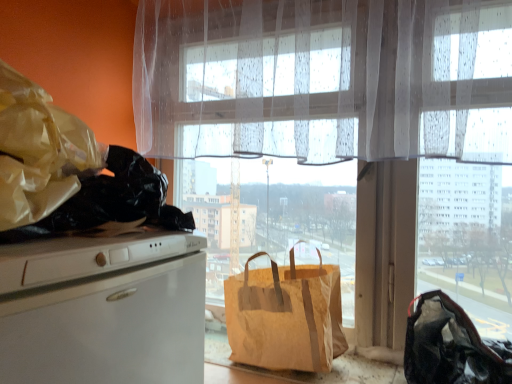
Question: Is translucent fabric window at center facing towards translucent white curtain at upper center?

Choices:
 (A) yes
 (B) no

Answer: (A)

Question: Does translucent fabric window at center appear on the left side of translucent white curtain at upper center?

Choices:
 (A) yes
 (B) no

Answer: (B)

Question: Does translucent fabric window at center come in front of translucent white curtain at upper center?

Choices:
 (A) yes
 (B) no

Answer: (B)

Question: From a real-world perspective, is translucent fabric window at center located beneath translucent white curtain at upper center?

Choices:
 (A) no
 (B) yes

Answer: (B)

Question: Does translucent fabric window at center have a greater height compared to translucent white curtain at upper center?

Choices:
 (A) yes
 (B) no

Answer: (A)

Question: Considering the relative sizes of translucent fabric window at center and translucent white curtain at upper center in the image provided, is translucent fabric window at center shorter than translucent white curtain at upper center?

Choices:
 (A) no
 (B) yes

Answer: (A)

Question: From the image's perspective, is brown paper bag at window, the second handbag viewed from the right, under black fabric bag at lower right, acting as the 1th handbag starting from the right?

Choices:
 (A) yes
 (B) no

Answer: (B)

Question: Does brown paper bag at window, the first handbag when ordered from left to right, have a greater width compared to black fabric bag at lower right, acting as the 1th handbag starting from the right?

Choices:
 (A) no
 (B) yes

Answer: (A)

Question: From a real-world perspective, is brown paper bag at window, the first handbag when ordered from left to right, beneath black fabric bag at lower right, acting as the 2th handbag starting from the left?

Choices:
 (A) no
 (B) yes

Answer: (A)

Question: Can you confirm if brown paper bag at window, the second handbag viewed from the right, is thinner than black fabric bag at lower right, acting as the 1th handbag starting from the right?

Choices:
 (A) no
 (B) yes

Answer: (B)

Question: Considering the relative sizes of brown paper bag at window, the second handbag viewed from the right, and black fabric bag at lower right, acting as the 2th handbag starting from the left, in the image provided, is brown paper bag at window, the second handbag viewed from the right, taller than black fabric bag at lower right, acting as the 2th handbag starting from the left,?

Choices:
 (A) no
 (B) yes

Answer: (B)

Question: Does brown paper bag at window, the first handbag when ordered from left to right, have a lesser height compared to black fabric bag at lower right, acting as the 1th handbag starting from the right?

Choices:
 (A) yes
 (B) no

Answer: (B)

Question: Does translucent white curtain at upper center turn towards black fabric bag at lower right, acting as the 2th handbag starting from the left?

Choices:
 (A) no
 (B) yes

Answer: (A)